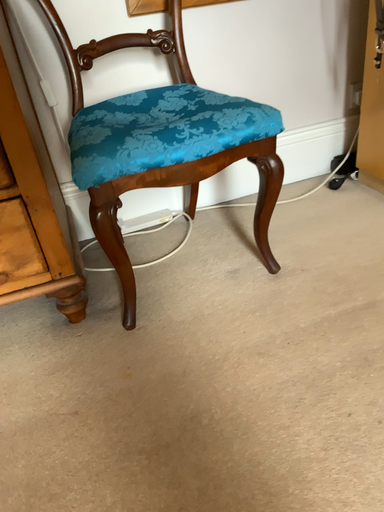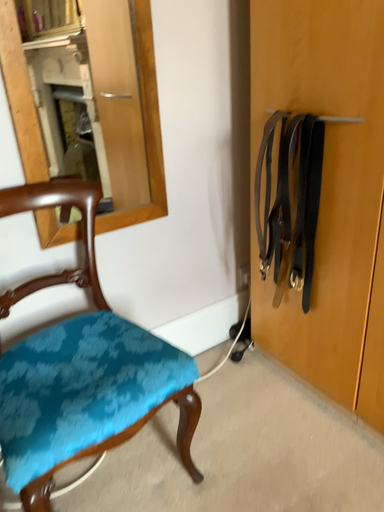
Question: Which way did the camera rotate in the video?

Choices:
 (A) rotated right
 (B) rotated left

Answer: (A)